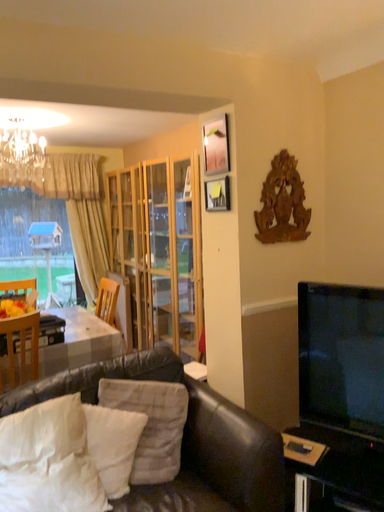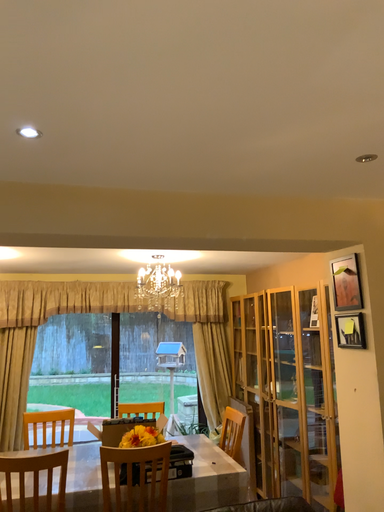
Question: How did the camera likely rotate when shooting the video?

Choices:
 (A) rotated right
 (B) rotated left

Answer: (B)